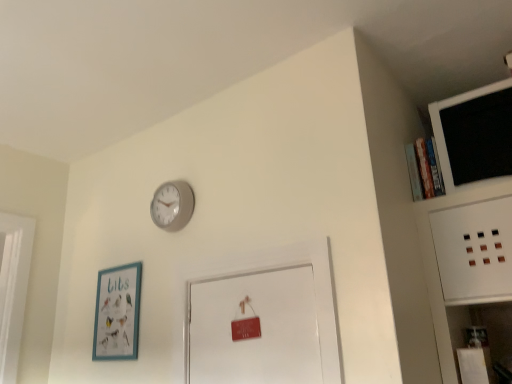
Question: Is black matte computer monitor at upper right facing away from matte gray clock at upper center?

Choices:
 (A) no
 (B) yes

Answer: (A)

Question: Does black matte computer monitor at upper right have a smaller size compared to matte gray clock at upper center?

Choices:
 (A) no
 (B) yes

Answer: (A)

Question: From a real-world perspective, is black matte computer monitor at upper right on top of matte gray clock at upper center?

Choices:
 (A) no
 (B) yes

Answer: (B)

Question: Are black matte computer monitor at upper right and matte gray clock at upper center beside each other?

Choices:
 (A) yes
 (B) no

Answer: (B)

Question: From the image's perspective, is black matte computer monitor at upper right below matte gray clock at upper center?

Choices:
 (A) yes
 (B) no

Answer: (B)

Question: From the image's perspective, is black matte computer monitor at upper right above matte gray clock at upper center?

Choices:
 (A) yes
 (B) no

Answer: (A)

Question: Could black matte computer monitor at upper right be considered to be inside teal matte picture frame at lower left?

Choices:
 (A) yes
 (B) no

Answer: (B)

Question: Considering the relative sizes of teal matte picture frame at lower left and black matte computer monitor at upper right in the image provided, is teal matte picture frame at lower left bigger than black matte computer monitor at upper right?

Choices:
 (A) no
 (B) yes

Answer: (A)

Question: Could you tell me if teal matte picture frame at lower left is facing black matte computer monitor at upper right?

Choices:
 (A) no
 (B) yes

Answer: (A)

Question: Is teal matte picture frame at lower left facing away from black matte computer monitor at upper right?

Choices:
 (A) yes
 (B) no

Answer: (B)

Question: Is teal matte picture frame at lower left wider than black matte computer monitor at upper right?

Choices:
 (A) yes
 (B) no

Answer: (B)

Question: Considering the relative positions of teal matte picture frame at lower left and black matte computer monitor at upper right in the image provided, is teal matte picture frame at lower left to the right of black matte computer monitor at upper right from the viewer's perspective?

Choices:
 (A) yes
 (B) no

Answer: (B)

Question: Can you confirm if matte gray clock at upper center is positioned to the right of teal matte picture frame at lower left?

Choices:
 (A) yes
 (B) no

Answer: (A)